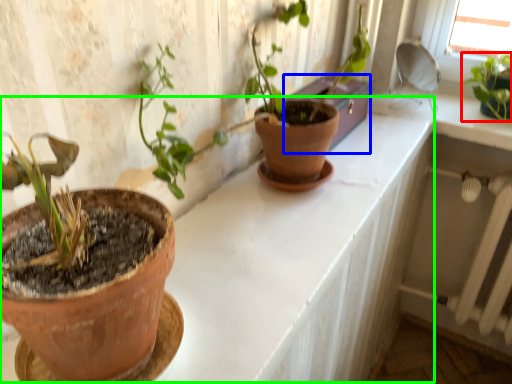
Question: Estimate the real-world distances between objects in this image. Which object is farther from houseplant (highlighted by a red box), window box (highlighted by a blue box) or counter (highlighted by a green box)?

Choices:
 (A) window box
 (B) counter

Answer: (B)